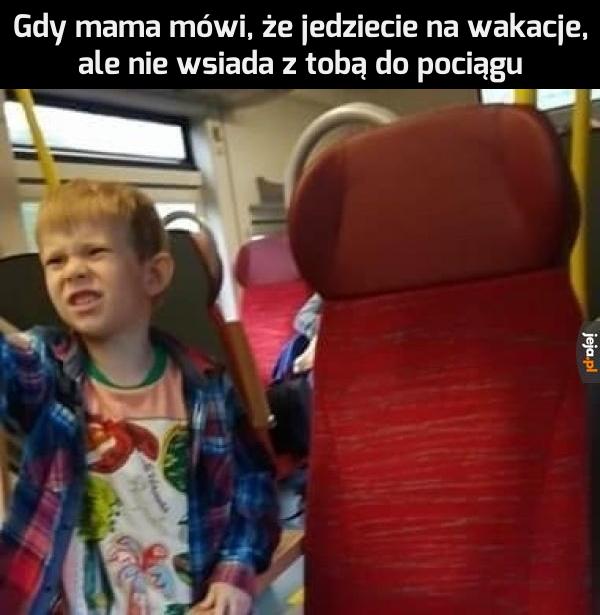
Locate an element on the screen. This screenshot has width=600, height=615. red seat is located at coordinates (443, 375), (269, 276).